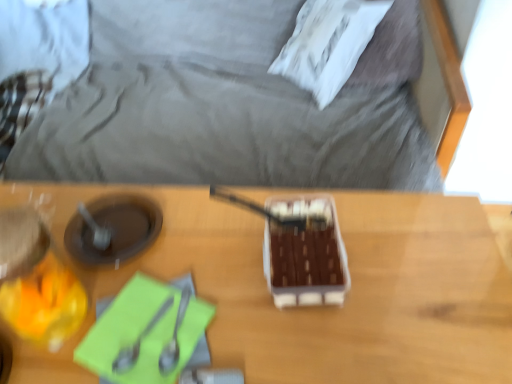
The image size is (512, 384). I want to click on free area behind green matte notepad at lower left, so click(194, 236).